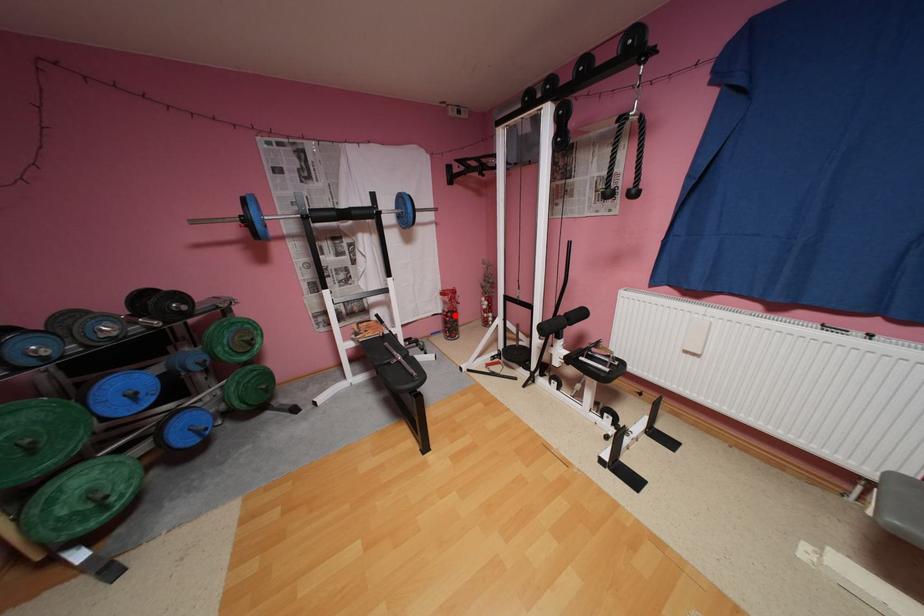
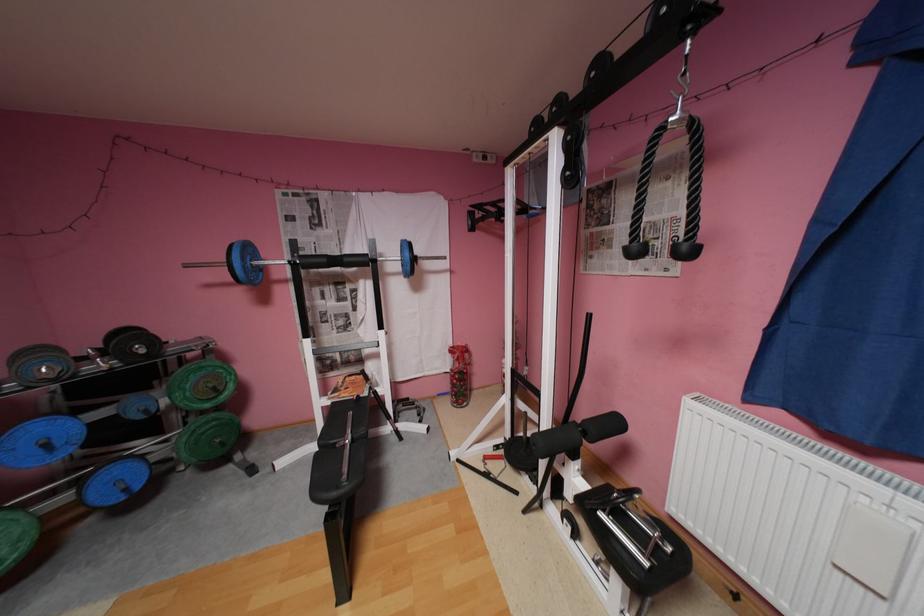
Question: I am providing you with two images of the same scene from different viewpoints. A red point is shown in image1. For the corresponding object point in image2, is it positioned nearer or farther from the camera?

Choices:
 (A) Nearer
 (B) Farther

Answer: (B)